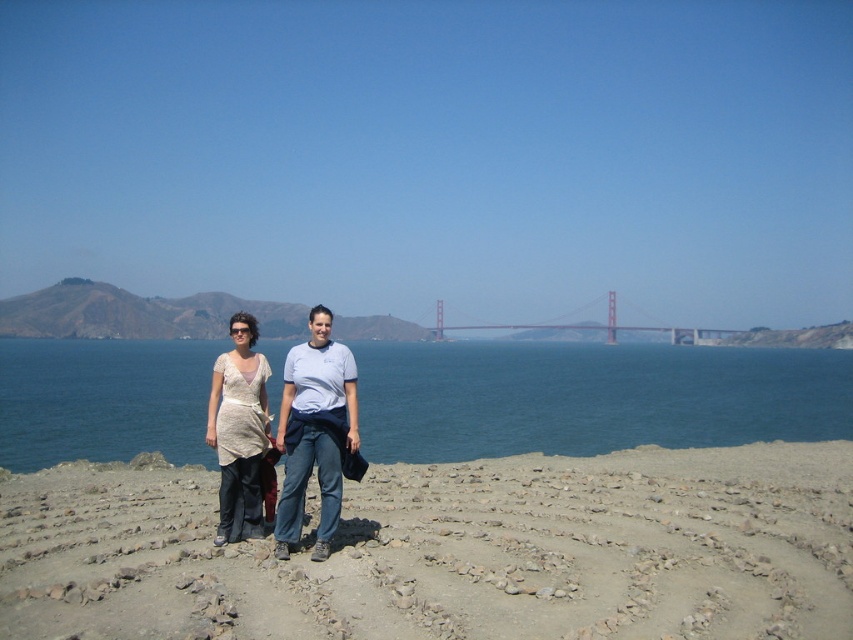
Which is more to the left, matte white blouse at center or red painted steel bridge at center?

matte white blouse at center is more to the left.

What do you see at coordinates (316, 433) in the screenshot? I see `matte white blouse at center` at bounding box center [316, 433].

Is point (299, 378) in front of point (717, 337)?

Yes, point (299, 378) is in front of point (717, 337).

The height and width of the screenshot is (640, 853). In order to click on matte white blouse at center in this screenshot , I will do `click(316, 433)`.

Locate an element on the screen. gray gravel at center is located at coordinates (451, 552).

Based on the photo, who is taller, gray gravel at center or blue water at center?

blue water at center

The image size is (853, 640). What are the coordinates of `gray gravel at center` in the screenshot? It's located at (451, 552).

Which of these two, gray gravel at center or matte white blouse at center, stands shorter?

With less height is matte white blouse at center.

Which is more to the right, gray gravel at center or matte white blouse at center?

gray gravel at center is more to the right.

Describe the element at coordinates (451, 552) in the screenshot. I see `gray gravel at center` at that location.

Locate an element on the screen. gray gravel at center is located at coordinates (451, 552).